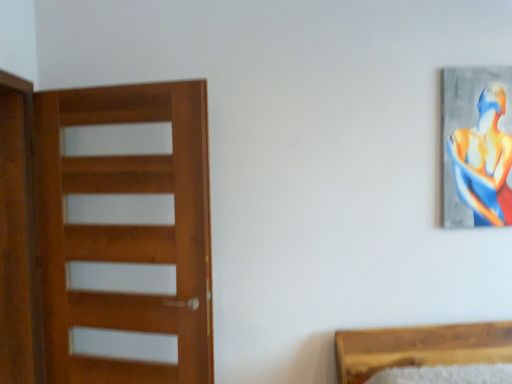
Question: From the image's perspective, is brown wooden screen door at left located above wooden door at left?

Choices:
 (A) yes
 (B) no

Answer: (A)

Question: Is brown wooden screen door at left oriented towards wooden door at left?

Choices:
 (A) no
 (B) yes

Answer: (B)

Question: Considering the relative sizes of brown wooden screen door at left and wooden door at left in the image provided, is brown wooden screen door at left taller than wooden door at left?

Choices:
 (A) no
 (B) yes

Answer: (B)

Question: From a real-world perspective, is brown wooden screen door at left physically above wooden door at left?

Choices:
 (A) yes
 (B) no

Answer: (A)

Question: From the image's perspective, would you say brown wooden screen door at left is shown under wooden door at left?

Choices:
 (A) no
 (B) yes

Answer: (A)

Question: From a real-world perspective, is brown wooden screen door at left beneath wooden door at left?

Choices:
 (A) yes
 (B) no

Answer: (B)

Question: Could metallic silver painting at upper right be considered to be inside wooden door at left?

Choices:
 (A) no
 (B) yes

Answer: (A)

Question: From a real-world perspective, does wooden door at left stand above metallic silver painting at upper right?

Choices:
 (A) no
 (B) yes

Answer: (A)

Question: Is wooden door at left behind metallic silver painting at upper right?

Choices:
 (A) yes
 (B) no

Answer: (B)

Question: Considering the relative sizes of wooden door at left and metallic silver painting at upper right in the image provided, is wooden door at left bigger than metallic silver painting at upper right?

Choices:
 (A) no
 (B) yes

Answer: (B)

Question: From a real-world perspective, is wooden door at left physically below metallic silver painting at upper right?

Choices:
 (A) yes
 (B) no

Answer: (A)

Question: Considering the relative positions of wooden door at left and metallic silver painting at upper right in the image provided, is wooden door at left to the right of metallic silver painting at upper right from the viewer's perspective?

Choices:
 (A) no
 (B) yes

Answer: (A)

Question: Is metallic silver painting at upper right wider than brown wooden screen door at left?

Choices:
 (A) yes
 (B) no

Answer: (B)